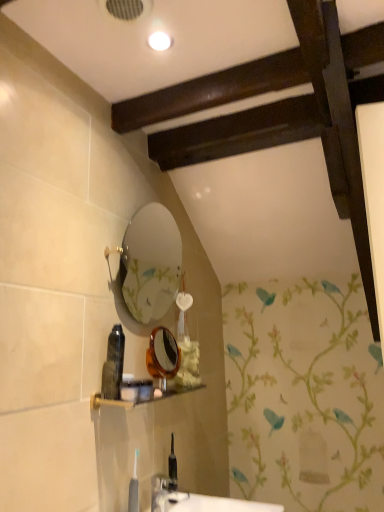
Describe the element at coordinates (145, 390) in the screenshot. I see `translucent plastic toothbrush at lower center, the third toiletry when ordered from top to bottom` at that location.

How much space does translucent plastic toothbrush at lower center, the third toiletry when ordered from top to bottom, occupy horizontally?

It is 2.27 inches.

Measure the distance between translucent plastic bottle at center, marked as the 4th toiletry in a bottom-to-top arrangement, and camera.

A distance of 4.31 feet exists between translucent plastic bottle at center, marked as the 4th toiletry in a bottom-to-top arrangement, and camera.

Based on the photo, in order to face translucent plastic bottle at center, which appears as the 1th toiletry when viewed from the top, should I rotate leftwards or rightwards?

Turn left by 10.116 degrees to look at translucent plastic bottle at center, which appears as the 1th toiletry when viewed from the top.

The width and height of the screenshot is (384, 512). Describe the element at coordinates (134, 487) in the screenshot. I see `blue plastic toothbrush at lower center, which appears as the fourth toiletry when viewed from the top` at that location.

Where is `translucent plastic toothbrush at lower center, the third toiletry when ordered from top to bottom`? translucent plastic toothbrush at lower center, the third toiletry when ordered from top to bottom is located at coordinates [145, 390].

Is there a large distance between translucent plastic toothbrush at lower center, the second toiletry ordered from the bottom, and blue plastic toothbrush at lower center, which appears as the fourth toiletry when viewed from the top?

translucent plastic toothbrush at lower center, the second toiletry ordered from the bottom, is actually quite close to blue plastic toothbrush at lower center, which appears as the fourth toiletry when viewed from the top.

Is translucent plastic toothbrush at lower center, the third toiletry when ordered from top to bottom, behind blue plastic toothbrush at lower center, acting as the 1th toiletry starting from the bottom?

Yes, translucent plastic toothbrush at lower center, the third toiletry when ordered from top to bottom, is behind blue plastic toothbrush at lower center, acting as the 1th toiletry starting from the bottom.

From the image's perspective, is translucent plastic toothbrush at lower center, the second toiletry ordered from the bottom, beneath blue plastic toothbrush at lower center, which appears as the fourth toiletry when viewed from the top?

Actually, translucent plastic toothbrush at lower center, the second toiletry ordered from the bottom, appears above blue plastic toothbrush at lower center, which appears as the fourth toiletry when viewed from the top, in the image.

Measure the distance between translucent plastic toothbrush at lower center, the third toiletry when ordered from top to bottom, and blue plastic toothbrush at lower center, acting as the 1th toiletry starting from the bottom.

translucent plastic toothbrush at lower center, the third toiletry when ordered from top to bottom, is 9.51 inches away from blue plastic toothbrush at lower center, acting as the 1th toiletry starting from the bottom.

Is point (176, 343) farther from viewer compared to point (137, 451)?

Yes, it is.

Looking at the image, does translucent amber mirror at center seem bigger or smaller compared to blue plastic toothbrush at lower center, acting as the 1th toiletry starting from the bottom?

Clearly, translucent amber mirror at center is larger in size than blue plastic toothbrush at lower center, acting as the 1th toiletry starting from the bottom.

Could you measure the distance between translucent amber mirror at center and blue plastic toothbrush at lower center, acting as the 1th toiletry starting from the bottom?

translucent amber mirror at center and blue plastic toothbrush at lower center, acting as the 1th toiletry starting from the bottom, are 12.99 inches apart from each other.

Could you tell me if translucent amber mirror at center is facing blue plastic toothbrush at lower center, which appears as the fourth toiletry when viewed from the top?

No, translucent amber mirror at center is not aimed at blue plastic toothbrush at lower center, which appears as the fourth toiletry when viewed from the top.

Considering the relative sizes of translucent plastic bottle at center, which appears as the 1th toiletry when viewed from the top, and matte plastic shelf at lower center in the image provided, is translucent plastic bottle at center, which appears as the 1th toiletry when viewed from the top, taller than matte plastic shelf at lower center?

Yes, translucent plastic bottle at center, which appears as the 1th toiletry when viewed from the top, is taller than matte plastic shelf at lower center.

From a real-world perspective, is translucent plastic bottle at center, marked as the 4th toiletry in a bottom-to-top arrangement, positioned over matte plastic shelf at lower center based on gravity?

Yes.

Is matte plastic shelf at lower center a part of translucent plastic bottle at center, marked as the 4th toiletry in a bottom-to-top arrangement?

That's incorrect, matte plastic shelf at lower center is not inside translucent plastic bottle at center, marked as the 4th toiletry in a bottom-to-top arrangement.

In the image, is translucent plastic bottle at center, which appears as the 1th toiletry when viewed from the top, positioned in front of or behind matte plastic shelf at lower center?

translucent plastic bottle at center, which appears as the 1th toiletry when viewed from the top, is positioned farther from the viewer than matte plastic shelf at lower center.

Which object is further away from the camera, translucent plastic bottle at center, which appears as the 1th toiletry when viewed from the top, or translucent plastic tube at center, the 2th toiletry from the top?

Positioned behind is translucent plastic bottle at center, which appears as the 1th toiletry when viewed from the top.

Is translucent plastic tube at center, the 2th toiletry from the top, at the back of translucent plastic bottle at center, marked as the 4th toiletry in a bottom-to-top arrangement?

translucent plastic bottle at center, marked as the 4th toiletry in a bottom-to-top arrangement, is not turned away from translucent plastic tube at center, the 2th toiletry from the top.

Considering the sizes of translucent plastic bottle at center, marked as the 4th toiletry in a bottom-to-top arrangement, and translucent plastic tube at center, acting as the third toiletry starting from the bottom, in the image, is translucent plastic bottle at center, marked as the 4th toiletry in a bottom-to-top arrangement, taller or shorter than translucent plastic tube at center, acting as the third toiletry starting from the bottom,?

Considering their sizes, translucent plastic bottle at center, marked as the 4th toiletry in a bottom-to-top arrangement, has more height than translucent plastic tube at center, acting as the third toiletry starting from the bottom.

Which is further, (110,339) or (139,401)?

The point (139,401) is farther.

Is matte plastic shelf at lower center directly adjacent to translucent amber mirror at center?

No.

From the picture: How many degrees apart are the facing directions of matte plastic shelf at lower center and translucent amber mirror at center?

12.7 degrees.

Based on the photo, from the image's perspective, between matte plastic shelf at lower center and translucent amber mirror at center, who is located below?

From the image's view, matte plastic shelf at lower center is below.

Which of these two, matte plastic shelf at lower center or translucent amber mirror at center, is bigger?

translucent amber mirror at center.

Looking at this image, is translucent amber mirror at center shorter than matte plastic shelf at lower center?

No.

Is point (172, 345) more distant than point (104, 402)?

Yes.

Is translucent amber mirror at center not near matte plastic shelf at lower center?

No, translucent amber mirror at center is in close proximity to matte plastic shelf at lower center.

Is translucent amber mirror at center facing towards matte plastic shelf at lower center?

No, translucent amber mirror at center is not oriented towards matte plastic shelf at lower center.

Considering the relative sizes of matte plastic shelf at lower center and translucent plastic toothbrush at lower center, the third toiletry when ordered from top to bottom, in the image provided, is matte plastic shelf at lower center bigger than translucent plastic toothbrush at lower center, the third toiletry when ordered from top to bottom,?

Yes, matte plastic shelf at lower center is bigger than translucent plastic toothbrush at lower center, the third toiletry when ordered from top to bottom.

Is matte plastic shelf at lower center wider than translucent plastic toothbrush at lower center, the third toiletry when ordered from top to bottom?

Correct, the width of matte plastic shelf at lower center exceeds that of translucent plastic toothbrush at lower center, the third toiletry when ordered from top to bottom.

From the picture: Is matte plastic shelf at lower center placed right next to translucent plastic toothbrush at lower center, the second toiletry ordered from the bottom?

Yes, matte plastic shelf at lower center is next to translucent plastic toothbrush at lower center, the second toiletry ordered from the bottom.

Does matte plastic shelf at lower center contain translucent plastic toothbrush at lower center, the third toiletry when ordered from top to bottom?

No.

From a real-world perspective, starting from the blue plastic toothbrush at lower center, acting as the 1th toiletry starting from the bottom, which toiletry is the 1st one vertically above it? Please provide its 2D coordinates.

[(145, 390)]

From the image's perspective, starting from the translucent amber mirror at center, which toiletry is the 3rd one below? Please provide its 2D coordinates.

[(134, 487)]

Considering their positions, is translucent plastic bottle at center, marked as the 4th toiletry in a bottom-to-top arrangement, positioned closer to translucent plastic tube at center, acting as the third toiletry starting from the bottom, than translucent amber mirror at center?

translucent amber mirror at center is closer to translucent plastic tube at center, acting as the third toiletry starting from the bottom.

Based on their spatial positions, is translucent plastic tube at center, acting as the third toiletry starting from the bottom, or translucent amber mirror at center closer to matte plastic shelf at lower center?

Based on the image, translucent plastic tube at center, acting as the third toiletry starting from the bottom, appears to be nearer to matte plastic shelf at lower center.

Which object lies further to the anchor point blue plastic toothbrush at lower center, which appears as the fourth toiletry when viewed from the top, translucent plastic bottle at center, which appears as the 1th toiletry when viewed from the top, or matte plastic shelf at lower center?

Among the two, translucent plastic bottle at center, which appears as the 1th toiletry when viewed from the top, is located further to blue plastic toothbrush at lower center, which appears as the fourth toiletry when viewed from the top.

From the image, which object appears to be nearer to blue plastic toothbrush at lower center, acting as the 1th toiletry starting from the bottom, translucent plastic bottle at center, marked as the 4th toiletry in a bottom-to-top arrangement, or translucent amber mirror at center?

The object closer to blue plastic toothbrush at lower center, acting as the 1th toiletry starting from the bottom, is translucent plastic bottle at center, marked as the 4th toiletry in a bottom-to-top arrangement.

Looking at the image, which one is located closer to translucent amber mirror at center, matte plastic shelf at lower center or blue plastic toothbrush at lower center, which appears as the fourth toiletry when viewed from the top?

matte plastic shelf at lower center is closer to translucent amber mirror at center.

Considering their positions, is matte plastic shelf at lower center positioned further to translucent plastic tube at center, the 2th toiletry from the top, than translucent plastic toothbrush at lower center, the second toiletry ordered from the bottom?

The object further to translucent plastic tube at center, the 2th toiletry from the top, is matte plastic shelf at lower center.

Based on their spatial positions, is translucent plastic tube at center, acting as the third toiletry starting from the bottom, or blue plastic toothbrush at lower center, which appears as the fourth toiletry when viewed from the top, closer to matte plastic shelf at lower center?

Among the two, translucent plastic tube at center, acting as the third toiletry starting from the bottom, is located nearer to matte plastic shelf at lower center.

When comparing their distances from translucent plastic tube at center, acting as the third toiletry starting from the bottom, does matte plastic shelf at lower center or translucent amber mirror at center seem closer?

matte plastic shelf at lower center lies closer to translucent plastic tube at center, acting as the third toiletry starting from the bottom, than the other object.

Find the location of `shelf that lies between translucent plastic bottle at center, which appears as the 1th toiletry when viewed from the top, and blue plastic toothbrush at lower center, acting as the 1th toiletry starting from the bottom, from top to bottom`. shelf that lies between translucent plastic bottle at center, which appears as the 1th toiletry when viewed from the top, and blue plastic toothbrush at lower center, acting as the 1th toiletry starting from the bottom, from top to bottom is located at coordinates (142, 400).

The width and height of the screenshot is (384, 512). In order to click on shelf between translucent plastic toothbrush at lower center, the second toiletry ordered from the bottom, and blue plastic toothbrush at lower center, which appears as the fourth toiletry when viewed from the top, vertically in this screenshot , I will do pos(142,400).

Find the location of a particular element. The height and width of the screenshot is (512, 384). toiletry between translucent plastic bottle at center, which appears as the 1th toiletry when viewed from the top, and translucent amber mirror at center from front to back is located at coordinates (145, 390).

The image size is (384, 512). In order to click on toiletry between translucent plastic bottle at center, marked as the 4th toiletry in a bottom-to-top arrangement, and translucent plastic toothbrush at lower center, the second toiletry ordered from the bottom, vertically in this screenshot , I will do `click(136, 390)`.